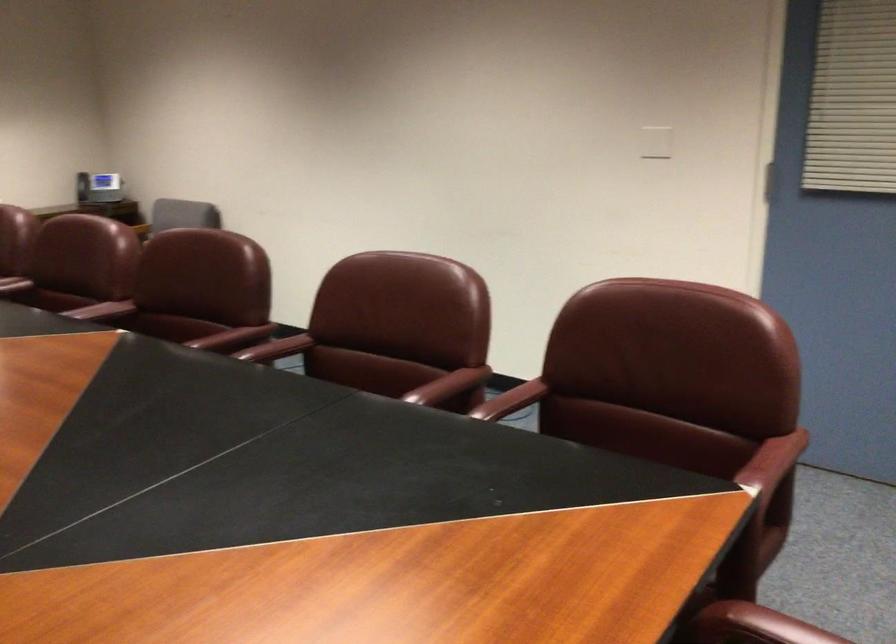
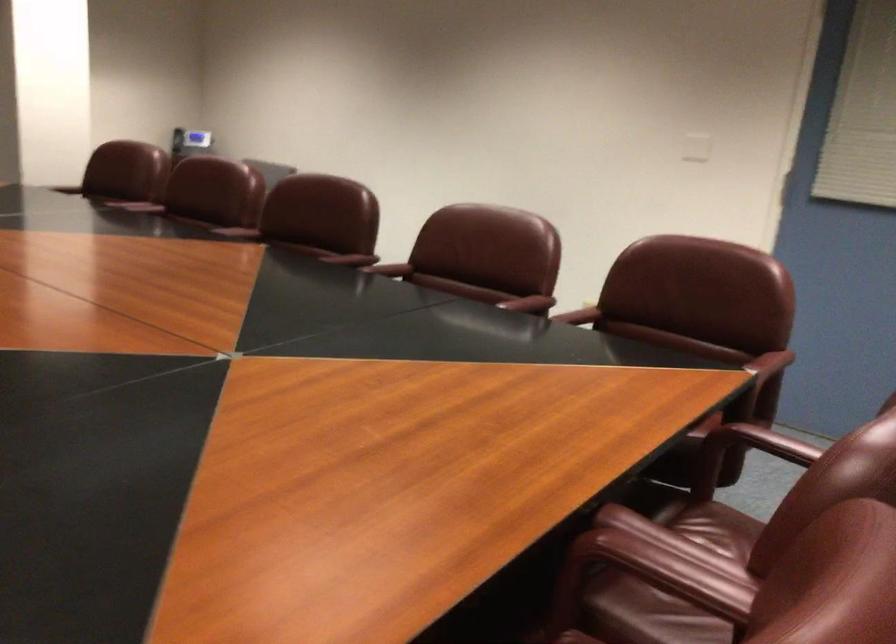
Question: The first image is from the beginning of the video and the second image is from the end. How did the camera likely rotate when shooting the video?

Choices:
 (A) Left
 (B) Right
 (C) Up
 (D) Down

Answer: (A)